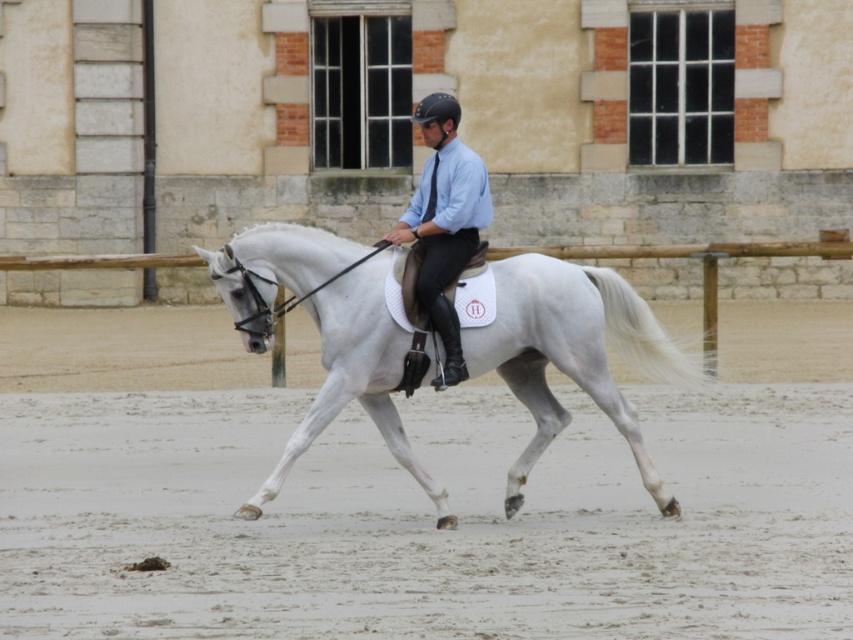
You are a photographer standing on the edge of the arena. You want to capture a photo of the white glossy horse at center and the sandy dirt track at center. According to the scene, which object is located to the left of the other?

The sandy dirt track at center is positioned on the left side of white glossy horse at center, so the sandy dirt track at center is to the left of the white glossy horse at center.

You are an equestrian judge observing a horse and rider in an arena. The rider is on the white glossy horse at center, and there is a sandy dirt track at center. Based on the arena setup, can the horse and rider navigate the track without any part of the horse exceeding the track boundaries?

The sandy dirt track at center is wider than the white glossy horse at center, so the horse and rider can navigate the track without exceeding the boundaries.